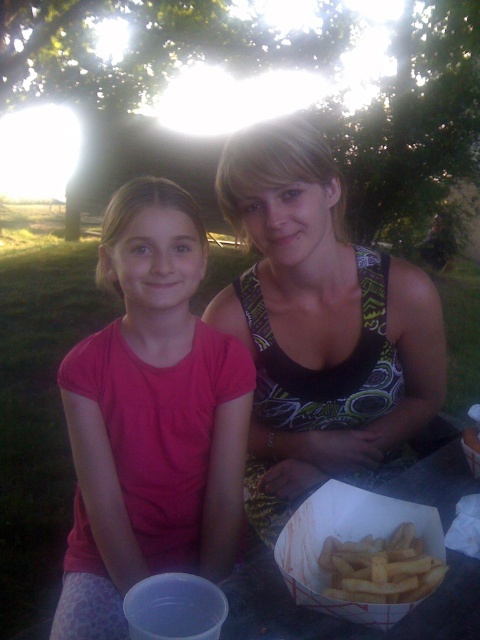
Question: Which of the following is the farthest from the observer?

Choices:
 (A) click(256, 179)
 (B) click(200, 536)

Answer: (B)

Question: Can you confirm if matte pink shirt at center is thinner than golden crispy fries at lower center?

Choices:
 (A) yes
 (B) no

Answer: (B)

Question: Which object appears farthest from the camera in this image?

Choices:
 (A) matte pink shirt at center
 (B) black printed tank top at center

Answer: (B)

Question: Can you confirm if matte pink shirt at center is positioned to the right of black printed tank top at center?

Choices:
 (A) yes
 (B) no

Answer: (B)

Question: Among these objects, which one is farthest from the camera?

Choices:
 (A) matte pink shirt at center
 (B) black printed tank top at center
 (C) golden crispy fries at lower center

Answer: (B)

Question: Is the position of black printed tank top at center more distant than that of golden crispy fries at lower center?

Choices:
 (A) no
 (B) yes

Answer: (B)